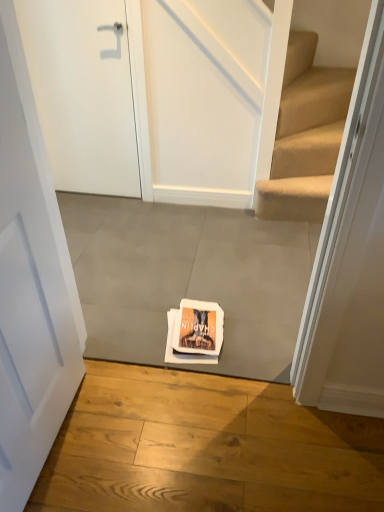
Locate an element on the screen. The width and height of the screenshot is (384, 512). vacant area that is situated to the right of white matte door at center, which is counted as the first door, starting from the front is located at coordinates (126, 439).